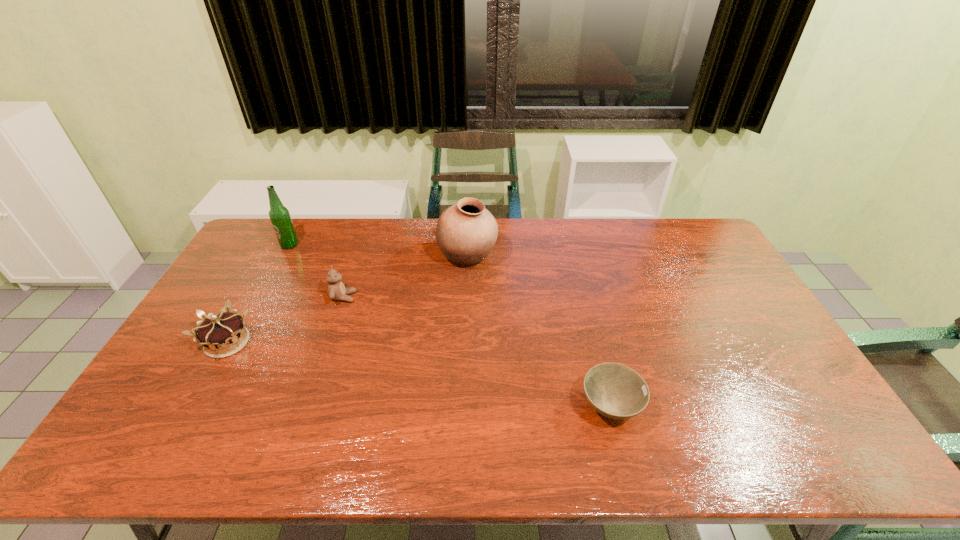
At what (x,y) coordinates should I click in order to perform the action: click on free space located on the front of the crown. Please return your answer as a coordinate pair (x, y). The height and width of the screenshot is (540, 960). Looking at the image, I should click on 201,390.

In order to click on free space located on the left of the shortest object in this screenshot , I will do `click(429, 407)`.

Locate an element on the screen. The height and width of the screenshot is (540, 960). beer bottle at the far edge is located at coordinates (279, 215).

Where is `pottery located in the far edge section of the desktop`? pottery located in the far edge section of the desktop is located at coordinates (466, 232).

What are the coordinates of `object that is positioned at the near edge` in the screenshot? It's located at (616, 391).

You are a GUI agent. You are given a task and a screenshot of the screen. Output one action in this format:
    pyautogui.click(x=<x>, y=<y>)
    Task: Click on the beer bottle that is at the left edge
    This screenshot has width=960, height=540.
    Given the screenshot: What is the action you would take?
    pyautogui.click(x=279, y=215)

Locate an element on the screen. crown situated at the left edge is located at coordinates (221, 335).

Locate an element on the screen. object located at the far left corner is located at coordinates (279, 215).

Locate an element on the screen. Image resolution: width=960 pixels, height=540 pixels. vacant region at the far edge of the desktop is located at coordinates (645, 242).

In the image, there is a desktop. Where is `free space at the near edge`? The image size is (960, 540). free space at the near edge is located at coordinates (688, 463).